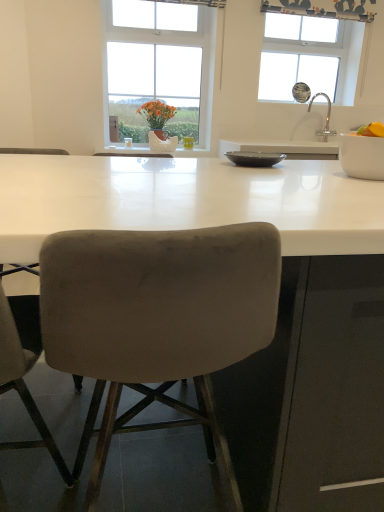
Question: From a real-world perspective, is velvet beige chair at lower left, which ranks as the first chair in left-to-right order, physically above white glossy bowl at right, the 1th bowl positioned from the right?

Choices:
 (A) no
 (B) yes

Answer: (A)

Question: Is white glossy bowl at right, placed as the second bowl when sorted from left to right, at the back of velvet beige chair at lower left, the second chair positioned from the right?

Choices:
 (A) yes
 (B) no

Answer: (B)

Question: Can you confirm if velvet beige chair at lower left, the second chair positioned from the right, is shorter than white glossy bowl at right, the 1th bowl positioned from the right?

Choices:
 (A) yes
 (B) no

Answer: (B)

Question: From a real-world perspective, is velvet beige chair at lower left, which ranks as the first chair in left-to-right order, physically below white glossy bowl at right, the 1th bowl positioned from the right?

Choices:
 (A) no
 (B) yes

Answer: (B)

Question: Is velvet beige chair at lower left, which ranks as the first chair in left-to-right order, facing towards white glossy bowl at right, the 1th bowl positioned from the right?

Choices:
 (A) yes
 (B) no

Answer: (B)

Question: From their relative heights in the image, would you say silver metallic faucet at upper right is taller or shorter than white glossy bowl at right, the 1th bowl positioned from the right?

Choices:
 (A) tall
 (B) short

Answer: (A)

Question: Considering the positions of point (334, 135) and point (342, 153), is point (334, 135) closer or farther from the camera than point (342, 153)?

Choices:
 (A) farther
 (B) closer

Answer: (A)

Question: Considering the positions of silver metallic faucet at upper right and white glossy bowl at right, placed as the second bowl when sorted from left to right, in the image, is silver metallic faucet at upper right bigger or smaller than white glossy bowl at right, placed as the second bowl when sorted from left to right,?

Choices:
 (A) big
 (B) small

Answer: (A)

Question: Relative to white glossy bowl at right, the 2th bowl from the back, is silver metallic faucet at upper right in front or behind?

Choices:
 (A) front
 (B) behind

Answer: (B)

Question: From their relative heights in the image, would you say silver metallic faucet at upper right is taller or shorter than white ceramic vase at center?

Choices:
 (A) tall
 (B) short

Answer: (A)

Question: In terms of size, does silver metallic faucet at upper right appear bigger or smaller than white ceramic vase at center?

Choices:
 (A) big
 (B) small

Answer: (A)

Question: From the image's perspective, is silver metallic faucet at upper right located above or below white ceramic vase at center?

Choices:
 (A) above
 (B) below

Answer: (A)

Question: Considering their positions, is silver metallic faucet at upper right located in front of or behind white ceramic vase at center?

Choices:
 (A) front
 (B) behind

Answer: (B)

Question: In the image, is white glossy bowl at right, the 2th bowl from the back, positioned in front of or behind silver metallic faucet at upper right?

Choices:
 (A) behind
 (B) front

Answer: (B)

Question: Considering the positions of white glossy bowl at right, the first bowl when ordered from front to back, and silver metallic faucet at upper right in the image, is white glossy bowl at right, the first bowl when ordered from front to back, taller or shorter than silver metallic faucet at upper right?

Choices:
 (A) tall
 (B) short

Answer: (B)